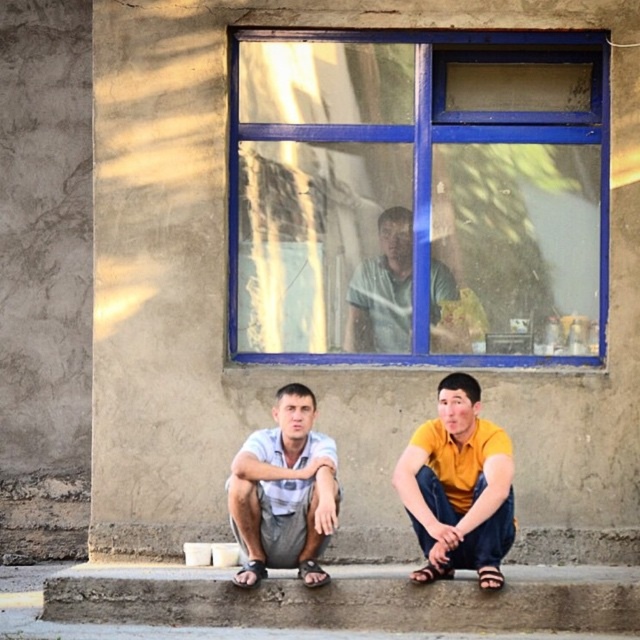
Question: Estimate the real-world distances between objects in this image. Which object is closer to the yellow matte shirt at lower right?

Choices:
 (A) blue painted glass window at upper center
 (B) matte green shirt at center
 (C) concrete at lower center

Answer: (C)

Question: Which point is closer to the camera?

Choices:
 (A) (488, 544)
 (B) (308, 496)
 (C) (371, 284)
 (D) (460, 86)

Answer: (A)

Question: Is light blue cotton shirt at center positioned in front of matte green shirt at center?

Choices:
 (A) yes
 (B) no

Answer: (A)

Question: Can you confirm if concrete at lower center is positioned to the right of yellow matte shirt at lower right?

Choices:
 (A) no
 (B) yes

Answer: (A)

Question: Considering the relative positions of blue painted glass window at upper center and light blue cotton shirt at center in the image provided, where is blue painted glass window at upper center located with respect to light blue cotton shirt at center?

Choices:
 (A) left
 (B) right

Answer: (B)

Question: Which object is positioned closest to the light blue cotton shirt at center?

Choices:
 (A) matte green shirt at center
 (B) concrete at lower center

Answer: (B)